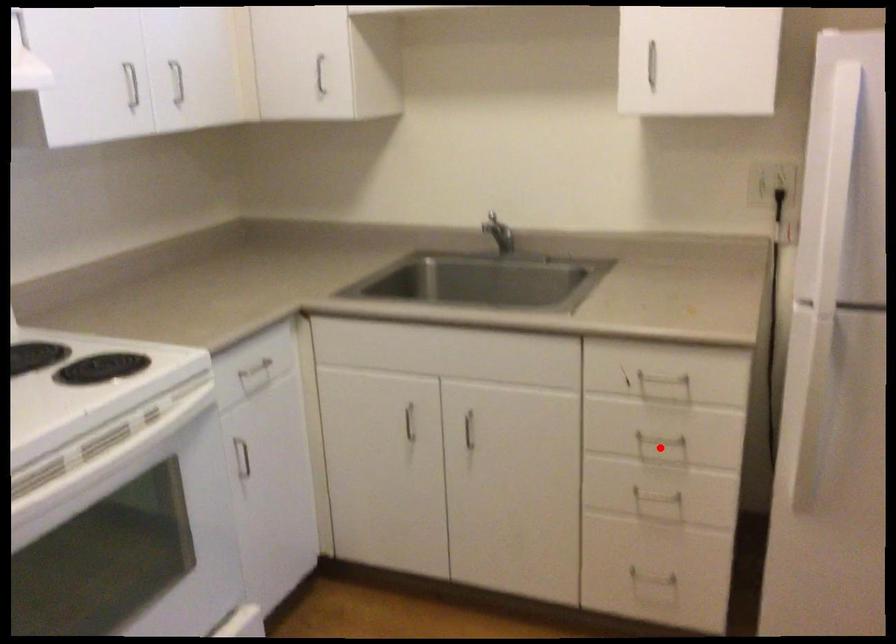
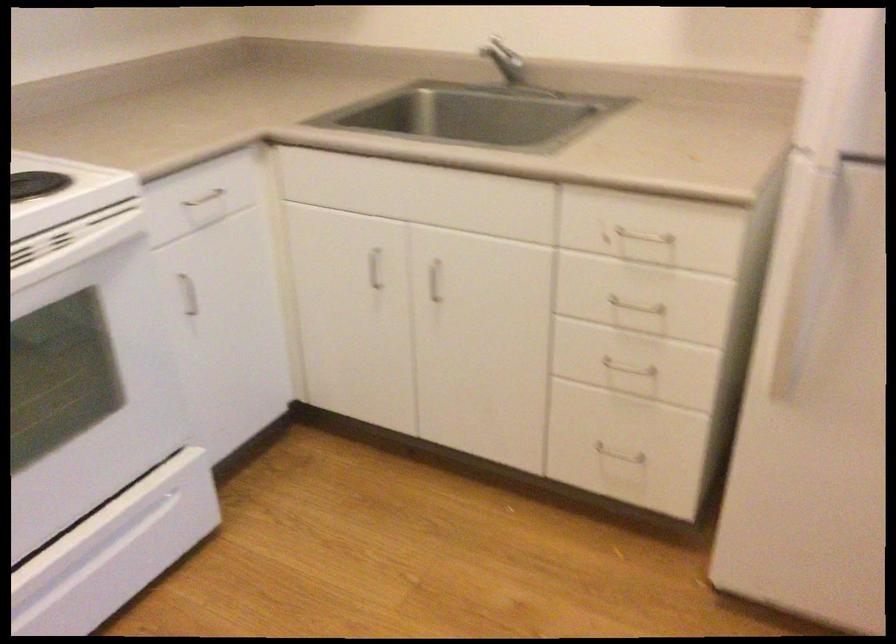
Question: I am providing you with two images of the same scene from different viewpoints. Image1 has a red point marked. In image2, the corresponding 3D location appears at what relative position? Reply with the corresponding letter.

Choices:
 (A) Closer
 (B) Farther

Answer: (A)